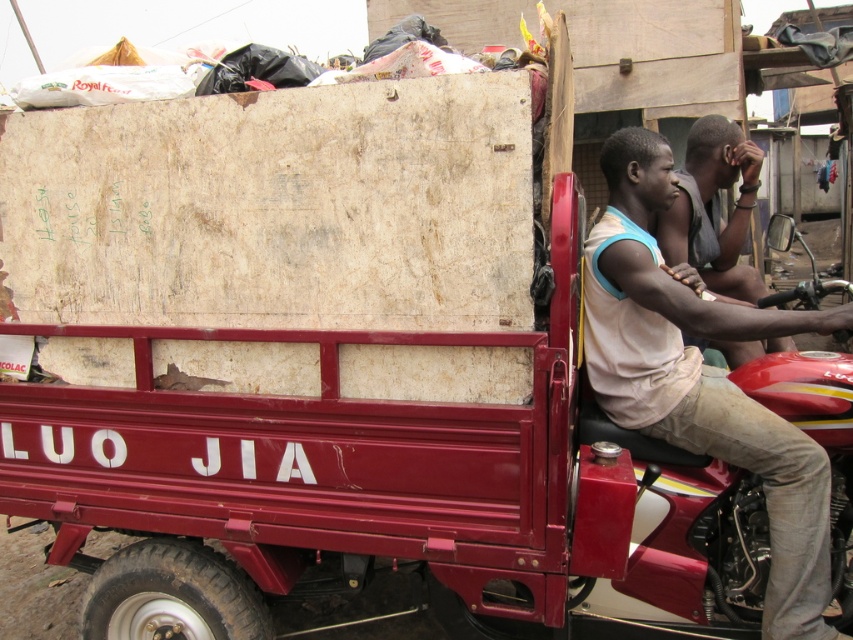
Consider the image. You are standing in front of the red truck with the text LUO JIA. There are two points marked on the truck bed. The first point is at coordinate (672, 186) and the second point is at (711, 240). Which of these two points is closer to you?

Point (672, 186) is closer to the viewer than point (711, 240).

You are a photographer trying to capture a candid shot of the two people in the truck bed. You want to ensure both the light beige cotton shirt at right and the light brown skin at center are clearly visible in the frame. Given their distance apart, is it feasible to include both in a single photo without moving the subjects?

The light beige cotton shirt at right and light brown skin at center are 25.22 inches apart, so yes, it is feasible to capture both in a single photo as they are within a reasonable distance for a candid shot without requiring the subjects to move.

Based on the scene description, which object is bigger in size between the light beige cotton shirt at right and the light brown skin at center?

The light beige cotton shirt at right has a larger size compared to light brown skin at center.